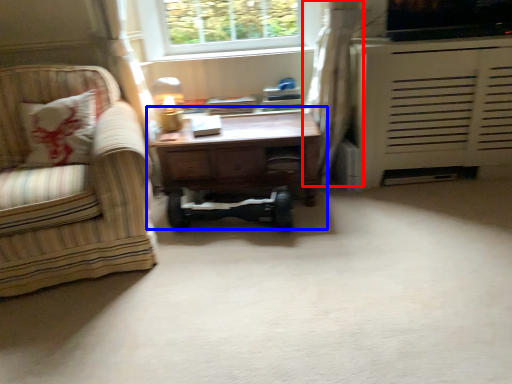
Question: Which object appears farthest to the camera in this image, curtain (highlighted by a red box) or table (highlighted by a blue box)?

Choices:
 (A) curtain
 (B) table

Answer: (B)